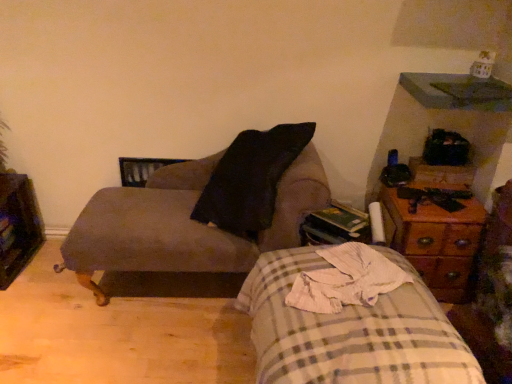
Where is `suede-like brown chair at upper left`? The image size is (512, 384). suede-like brown chair at upper left is located at coordinates (204, 210).

This screenshot has width=512, height=384. Find the location of `suede-like brown chair at upper left`. suede-like brown chair at upper left is located at coordinates (204, 210).

Looking at this image, from the image's perspective, is suede-like brown chair at upper left under wooden dresser at left?

Incorrect, from the image's perspective, suede-like brown chair at upper left is higher than wooden dresser at left.

What are the coordinates of `dresser to the left of suede-like brown chair at upper left` in the screenshot? It's located at click(18, 226).

Based on the photo, is suede-like brown chair at upper left next to wooden dresser at left and touching it?

suede-like brown chair at upper left and wooden dresser at left are not in contact.

Consider the image. Is suede-like brown chair at upper left outside of wooden dresser at left?

Yes, suede-like brown chair at upper left is located beyond the bounds of wooden dresser at left.

Locate an element on the screen. This screenshot has height=384, width=512. chair on the left of the plaid fabric bed at lower right is located at coordinates (204, 210).

What's the angular difference between suede-like brown chair at upper left and plaid fabric bed at lower right's facing directions?

The angle between the facing direction of suede-like brown chair at upper left and the facing direction of plaid fabric bed at lower right is 84 degrees.

Looking at their sizes, would you say suede-like brown chair at upper left is wider or thinner than plaid fabric bed at lower right?

In the image, suede-like brown chair at upper left appears to be more narrow than plaid fabric bed at lower right.

In the scene shown: Which is more to the right, suede-like brown chair at upper left or plaid fabric bed at lower right?

plaid fabric bed at lower right.

Is suede-like brown chair at upper left turned away from woodenmaterial/texturenightstand at right?

No, woodenmaterial/texturenightstand at right is not at the back of suede-like brown chair at upper left.

In the scene shown: Considering the relative positions of suede-like brown chair at upper left and woodenmaterial/texturenightstand at right in the image provided, is suede-like brown chair at upper left to the right of woodenmaterial/texturenightstand at right from the viewer's perspective?

In fact, suede-like brown chair at upper left is to the left of woodenmaterial/texturenightstand at right.

Which object is thinner, suede-like brown chair at upper left or woodenmaterial/texturenightstand at right?

Thinner between the two is woodenmaterial/texturenightstand at right.

Looking at this image, from a real-world perspective, is suede-like brown chair at upper left on top of woodenmaterial/texturenightstand at right?

Indeed, from a real-world perspective, suede-like brown chair at upper left stands above woodenmaterial/texturenightstand at right.

Which object is thinner, woodenmaterial/texturenightstand at right or wooden dresser at left?

wooden dresser at left is thinner.

From the image's perspective, which object appears higher, woodenmaterial/texturenightstand at right or wooden dresser at left?

wooden dresser at left.

Is wooden dresser at left a part of woodenmaterial/texturenightstand at right?

That's incorrect, wooden dresser at left is not inside woodenmaterial/texturenightstand at right.

From a real-world perspective, is woodenmaterial/texturenightstand at right positioned above or below wooden dresser at left?

In terms of real-world spatial position, woodenmaterial/texturenightstand at right is above wooden dresser at left.

Does plaid fabric bed at lower right have a smaller size compared to suede-like brown chair at upper left?

Correct, plaid fabric bed at lower right occupies less space than suede-like brown chair at upper left.

From the image's perspective, would you say plaid fabric bed at lower right is positioned over suede-like brown chair at upper left?

No.

From a real-world perspective, is plaid fabric bed at lower right located beneath suede-like brown chair at upper left?

Yes, from a real-world perspective, plaid fabric bed at lower right is below suede-like brown chair at upper left.

Is point (334, 299) in front of point (195, 212)?

Yes, it is in front of point (195, 212).

How far apart are wooden dresser at left and woodenmaterial/texturenightstand at right?

The distance of wooden dresser at left from woodenmaterial/texturenightstand at right is 6.08 feet.

In terms of size, does wooden dresser at left appear bigger or smaller than woodenmaterial/texturenightstand at right?

wooden dresser at left is smaller than woodenmaterial/texturenightstand at right.

Consider the image. Can you tell me how much wooden dresser at left and woodenmaterial/texturenightstand at right differ in facing direction?

2.16 degrees.

Is wooden dresser at left closer to camera compared to woodenmaterial/texturenightstand at right?

No, the depth of wooden dresser at left is greater than that of woodenmaterial/texturenightstand at right.

Find the location of a particular element. The height and width of the screenshot is (384, 512). dresser behind the plaid fabric bed at lower right is located at coordinates (18, 226).

From the image's perspective, which is above, plaid fabric bed at lower right or wooden dresser at left?

From the image's view, wooden dresser at left is above.

How many degrees apart are the facing directions of plaid fabric bed at lower right and wooden dresser at left?

84.6 degrees separate the facing orientations of plaid fabric bed at lower right and wooden dresser at left.

Considering the sizes of objects plaid fabric bed at lower right and wooden dresser at left in the image provided, who is taller, plaid fabric bed at lower right or wooden dresser at left?

plaid fabric bed at lower right is taller.

Locate an element on the screen. This screenshot has height=384, width=512. chair in front of the wooden dresser at left is located at coordinates (204, 210).

You are a GUI agent. You are given a task and a screenshot of the screen. Output one action in this format:
    pyautogui.click(x=<x>, y=<y>)
    Task: Click on the chair behind the plaid fabric bed at lower right
    
    Given the screenshot: What is the action you would take?
    pyautogui.click(x=204, y=210)

Based on the photo, considering their positions, is wooden dresser at left positioned further to suede-like brown chair at upper left than woodenmaterial/texturenightstand at right?

Based on the image, wooden dresser at left appears to be further to suede-like brown chair at upper left.

Considering their positions, is suede-like brown chair at upper left positioned closer to wooden dresser at left than woodenmaterial/texturenightstand at right?

suede-like brown chair at upper left is closer to wooden dresser at left.

Based on their spatial positions, is wooden dresser at left or suede-like brown chair at upper left further from woodenmaterial/texturenightstand at right?

wooden dresser at left is further to woodenmaterial/texturenightstand at right.

From the image, which object appears to be nearer to plaid fabric bed at lower right, wooden dresser at left or woodenmaterial/texturenightstand at right?

Based on the image, woodenmaterial/texturenightstand at right appears to be nearer to plaid fabric bed at lower right.

Looking at the image, which one is located closer to suede-like brown chair at upper left, plaid fabric bed at lower right or wooden dresser at left?

Among the two, plaid fabric bed at lower right is located nearer to suede-like brown chair at upper left.

From the image, which object appears to be nearer to plaid fabric bed at lower right, woodenmaterial/texturenightstand at right or suede-like brown chair at upper left?

suede-like brown chair at upper left is closer to plaid fabric bed at lower right.

Looking at the image, which one is located closer to wooden dresser at left, woodenmaterial/texturenightstand at right or suede-like brown chair at upper left?

The object closer to wooden dresser at left is suede-like brown chair at upper left.

Looking at the image, which one is located further to woodenmaterial/texturenightstand at right, suede-like brown chair at upper left or plaid fabric bed at lower right?

suede-like brown chair at upper left is positioned further to the anchor woodenmaterial/texturenightstand at right.

Where is `bed between suede-like brown chair at upper left and woodenmaterial/texturenightstand at right`? The height and width of the screenshot is (384, 512). bed between suede-like brown chair at upper left and woodenmaterial/texturenightstand at right is located at coordinates (349, 322).

Locate an element on the screen. bed between wooden dresser at left and woodenmaterial/texturenightstand at right in the horizontal direction is located at coordinates (349, 322).

What are the coordinates of `chair between wooden dresser at left and plaid fabric bed at lower right in the horizontal direction` in the screenshot? It's located at (204, 210).

At what (x,y) coordinates should I click in order to perform the action: click on chair between wooden dresser at left and woodenmaterial/texturenightstand at right. Please return your answer as a coordinate pair (x, y). Looking at the image, I should click on (204, 210).